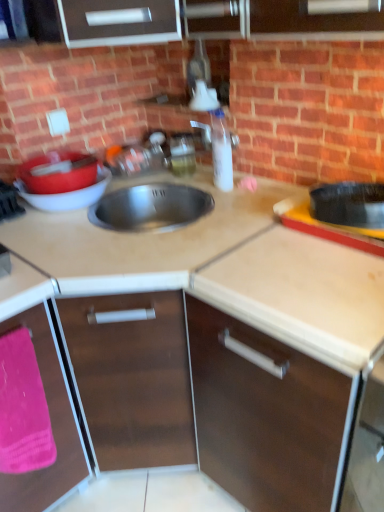
Where is `vacant region above brown matte cabinet at center, the 2th cabinetry positioned from the left (from a real-world perspective)`? This screenshot has width=384, height=512. vacant region above brown matte cabinet at center, the 2th cabinetry positioned from the left (from a real-world perspective) is located at coordinates (315, 271).